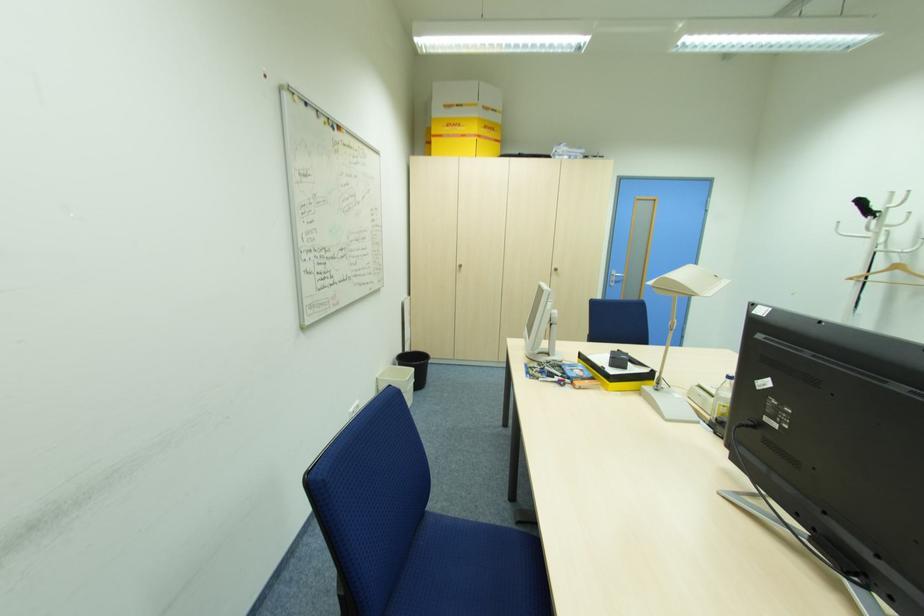
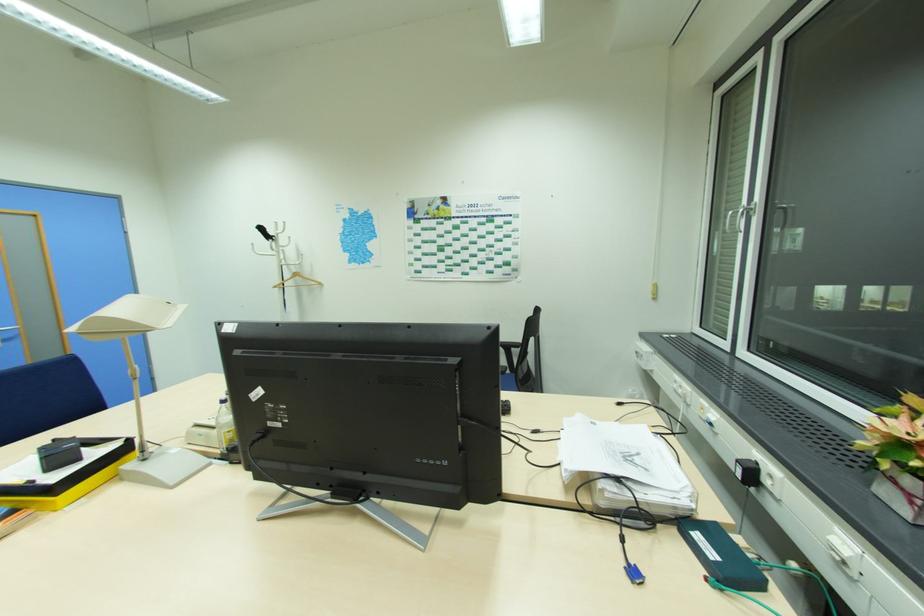
Find the pixel in the second image that matches pixel 715 397 in the first image.

(216, 428)